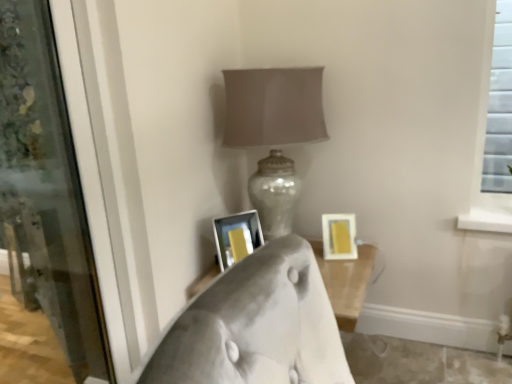
Question: Is point [332, 221] positioned closer to the camera than point [28, 208]?

Choices:
 (A) closer
 (B) farther

Answer: (A)

Question: Is yellow matte picture frame at lower right, arranged as the first picture frame when viewed from the right, wider or thinner than transparent glass screen door at left?

Choices:
 (A) wide
 (B) thin

Answer: (A)

Question: Which object is the closest to the transparent glass screen door at left?

Choices:
 (A) matte silver lamp at center
 (B) yellow matte picture frame at lower right, arranged as the first picture frame when viewed from the right
 (C) white glossy picture frame at center, the first picture frame from the left

Answer: (A)

Question: Estimate the real-world distances between objects in this image. Which object is farther from the matte silver lamp at center?

Choices:
 (A) white glossy picture frame at center, the first picture frame from the left
 (B) transparent glass screen door at left
 (C) yellow matte picture frame at lower right, which appears as the second picture frame when viewed from the left

Answer: (B)